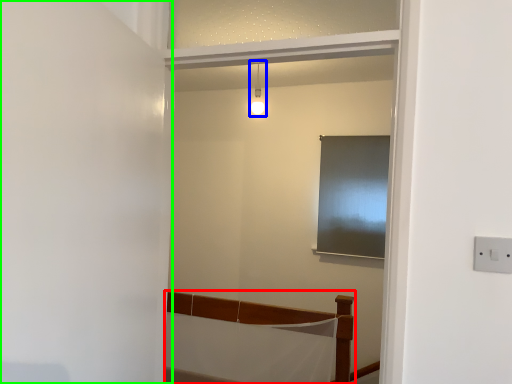
Question: Which object is the farthest from furniture (highlighted by a red box)? Choose among these: light fixture (highlighted by a blue box) or door (highlighted by a green box).

Choices:
 (A) light fixture
 (B) door

Answer: (A)